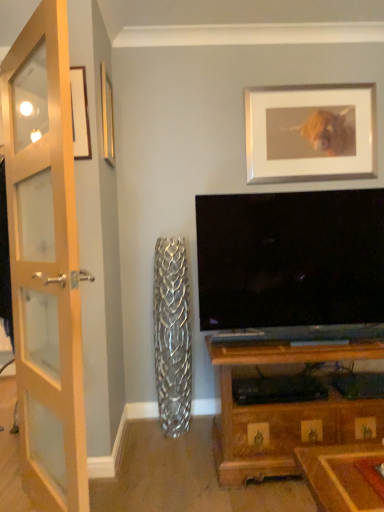
Question: Does wooden glass door at left lie in front of silver/metallic picture frame at upper center, the 2th picture frame in the left-to-right sequence?

Choices:
 (A) no
 (B) yes

Answer: (B)

Question: Is wooden glass door at left beside silver/metallic picture frame at upper center, the first picture frame when ordered from right to left?

Choices:
 (A) no
 (B) yes

Answer: (A)

Question: Considering the relative sizes of wooden glass door at left and silver/metallic picture frame at upper center, which ranks as the first picture frame in back-to-front order, in the image provided, is wooden glass door at left wider than silver/metallic picture frame at upper center, which ranks as the first picture frame in back-to-front order,?

Choices:
 (A) yes
 (B) no

Answer: (A)

Question: Is wooden glass door at left to the left of silver/metallic picture frame at upper center, the first picture frame when ordered from right to left, from the viewer's perspective?

Choices:
 (A) yes
 (B) no

Answer: (A)

Question: Is wooden glass door at left smaller than silver/metallic picture frame at upper center, the 2th picture frame viewed from the front?

Choices:
 (A) yes
 (B) no

Answer: (B)

Question: Would you say wooden glass door at left is to the left or to the right of wooden picture frame at upper left, which ranks as the first picture frame in left-to-right order, in the picture?

Choices:
 (A) left
 (B) right

Answer: (A)

Question: From a real-world perspective, is wooden glass door at left physically located above or below wooden picture frame at upper left, which ranks as the first picture frame in left-to-right order?

Choices:
 (A) above
 (B) below

Answer: (B)

Question: Is point (51, 330) positioned closer to the camera than point (107, 121)?

Choices:
 (A) closer
 (B) farther

Answer: (A)

Question: In terms of height, does wooden glass door at left look taller or shorter compared to wooden picture frame at upper left, placed as the second picture frame when sorted from right to left?

Choices:
 (A) tall
 (B) short

Answer: (A)

Question: In the image, is silver/metallic picture frame at upper center, the 2th picture frame in the left-to-right sequence, positioned in front of or behind wooden glass door at left?

Choices:
 (A) front
 (B) behind

Answer: (B)

Question: Choose the correct answer: Is silver/metallic picture frame at upper center, the 2th picture frame viewed from the front, inside wooden glass door at left or outside it?

Choices:
 (A) inside
 (B) outside

Answer: (B)

Question: Is point (273, 93) positioned closer to the camera than point (69, 224)?

Choices:
 (A) farther
 (B) closer

Answer: (A)

Question: Is silver/metallic picture frame at upper center, the 2th picture frame in the left-to-right sequence, to the left or to the right of wooden glass door at left in the image?

Choices:
 (A) right
 (B) left

Answer: (A)

Question: From the image's perspective, is wooden picture frame at upper left, the second picture frame when ordered from back to front, above or below silver/metallic picture frame at upper center, the 2th picture frame in the left-to-right sequence?

Choices:
 (A) below
 (B) above

Answer: (A)

Question: Based on their positions, is wooden picture frame at upper left, placed as the second picture frame when sorted from right to left, located to the left or right of silver/metallic picture frame at upper center, the 2th picture frame in the left-to-right sequence?

Choices:
 (A) right
 (B) left

Answer: (B)